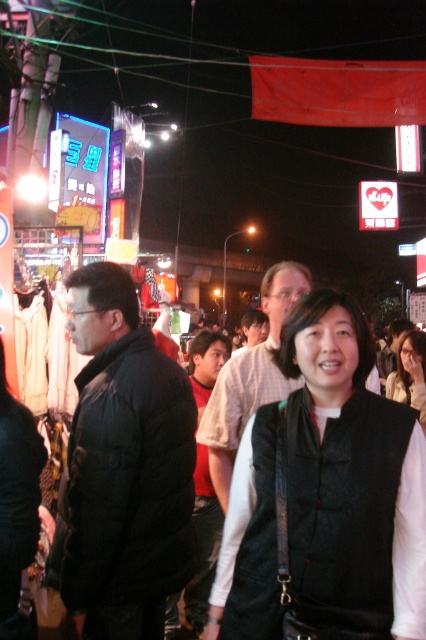
Between point (19, 420) and point (409, 362), which one is positioned in front?

Positioned in front is point (19, 420).

The height and width of the screenshot is (640, 426). Identify the location of black leather vest at center. (17, 509).

Where is `black leather vest at center`? black leather vest at center is located at coordinates (17, 509).

Identify the location of black leather vest at center. This screenshot has width=426, height=640. (17, 509).

Find the location of a particular element. black puffer jacket at center is located at coordinates (123, 467).

Is black puffer jacket at center above matte black shirt at center?

Incorrect, black puffer jacket at center is not positioned above matte black shirt at center.

Image resolution: width=426 pixels, height=640 pixels. Find the location of `black puffer jacket at center`. black puffer jacket at center is located at coordinates (123, 467).

Is black puffer jacket at center shorter than black leather vest at center?

In fact, black puffer jacket at center may be taller than black leather vest at center.

Is black puffer jacket at center positioned in front of black leather vest at center?

No.

The height and width of the screenshot is (640, 426). Find the location of `black puffer jacket at center`. black puffer jacket at center is located at coordinates (123, 467).